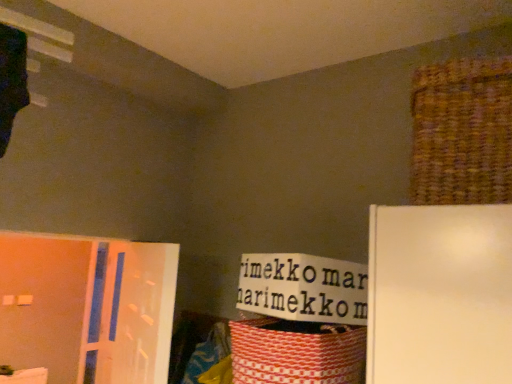
Question: From a real-world perspective, is red woven basket at lower right, which is the 1th basket from left to right, positioned above or below brown woven basket at upper right, which appears as the 2th basket when viewed from the left?

Choices:
 (A) above
 (B) below

Answer: (B)

Question: In terms of size, does red woven basket at lower right, marked as the 1th basket in a bottom-to-top arrangement, appear bigger or smaller than brown woven basket at upper right, which appears as the 1th basket when viewed from the top?

Choices:
 (A) big
 (B) small

Answer: (B)

Question: Which object is positioned closest to the red woven basket at lower right, marked as the 1th basket in a bottom-to-top arrangement?

Choices:
 (A) brown woven basket at upper right, which is the 2th basket from bottom to top
 (B) translucent plastic screen door at left

Answer: (B)

Question: Which is nearer to the translucent plastic screen door at left?

Choices:
 (A) brown woven basket at upper right, which appears as the 2th basket when viewed from the left
 (B) red woven basket at lower right, positioned as the second basket in right-to-left order

Answer: (B)